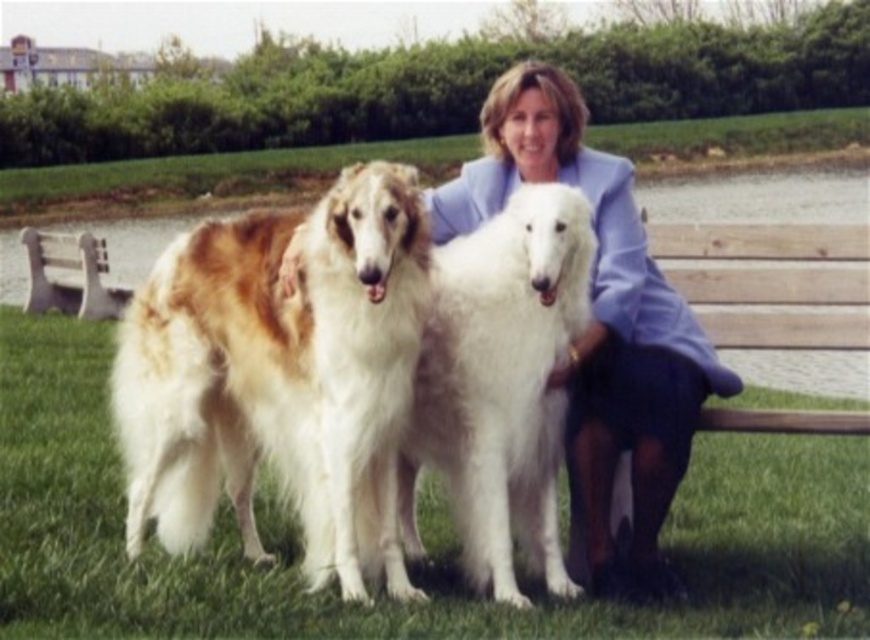
You are a photographer trying to capture a photo of the golden fur dog at center and the light blue fabric at center. If you want to ensure both are fully visible in the frame, which object should you adjust your camera angle to prioritize capturing first?

The golden fur dog at center is wider than the light blue fabric at center, so you should prioritize capturing the golden fur dog at center first to ensure it fits within the frame.